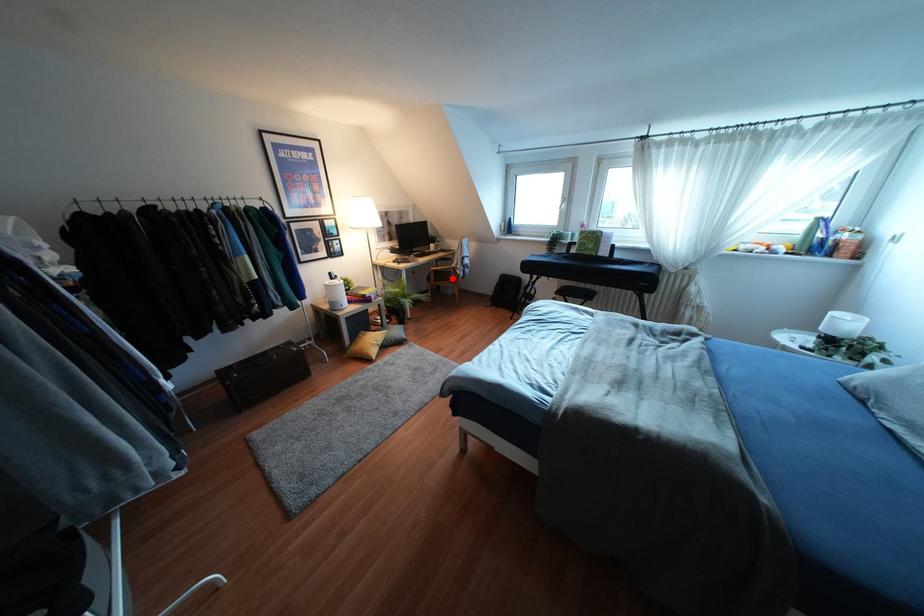
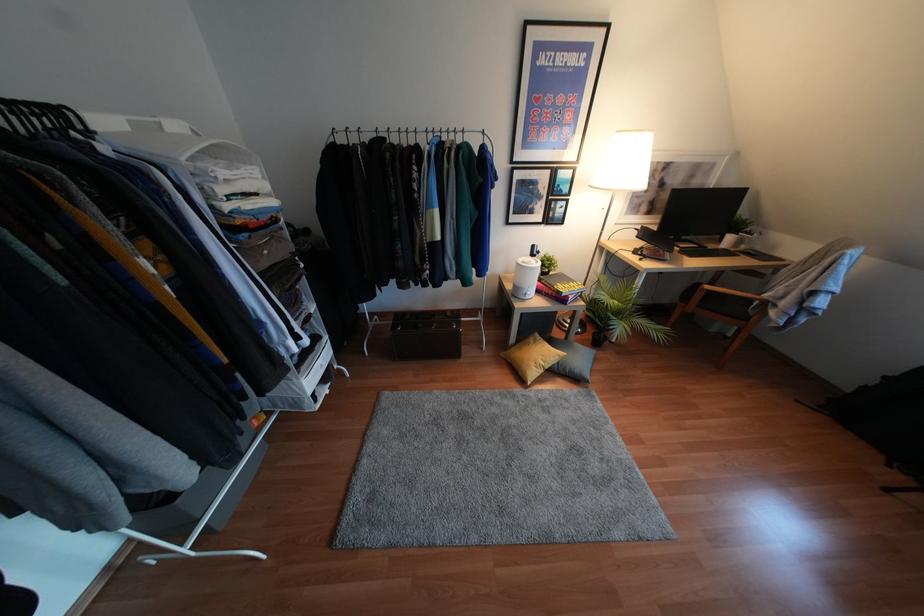
Find the pixel in the second image that matches the highlighted location in the first image.

(745, 318)